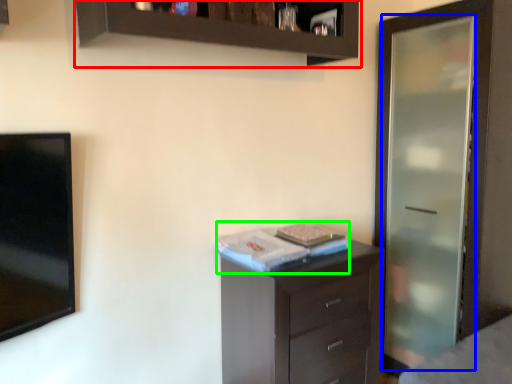
Question: Which object is the farthest from cupboard (highlighted by a red box)? Choose among these: screen door (highlighted by a blue box) or book (highlighted by a green box).

Choices:
 (A) screen door
 (B) book

Answer: (A)